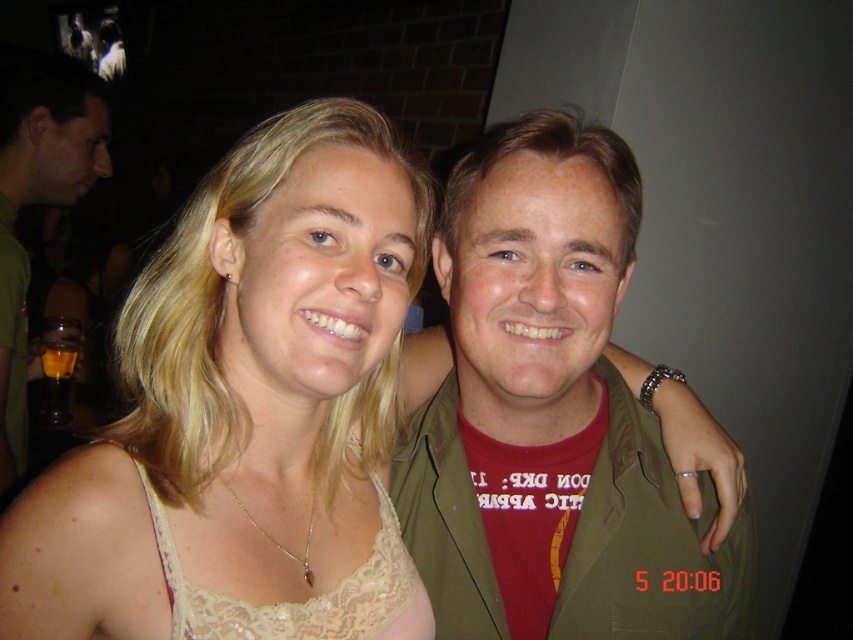
Who is positioned more to the left, lace beige top at center or green matte shirt at left?

green matte shirt at left is more to the left.

Find the location of a particular element. lace beige top at center is located at coordinates (247, 412).

Find the location of a particular element. The image size is (853, 640). lace beige top at center is located at coordinates (247, 412).

Who is positioned more to the left, green matte jacket at center or green matte shirt at left?

Positioned to the left is green matte shirt at left.

Can you confirm if green matte jacket at center is wider than green matte shirt at left?

Yes.

Locate an element on the screen. The height and width of the screenshot is (640, 853). green matte jacket at center is located at coordinates (549, 413).

Is lace beige top at center below green matte jacket at center?

No.

Is the position of lace beige top at center more distant than that of green matte jacket at center?

No, it is not.

Between point (331, 316) and point (540, 548), which one is positioned behind?

Positioned behind is point (540, 548).

This screenshot has width=853, height=640. In order to click on lace beige top at center in this screenshot , I will do `click(247, 412)`.